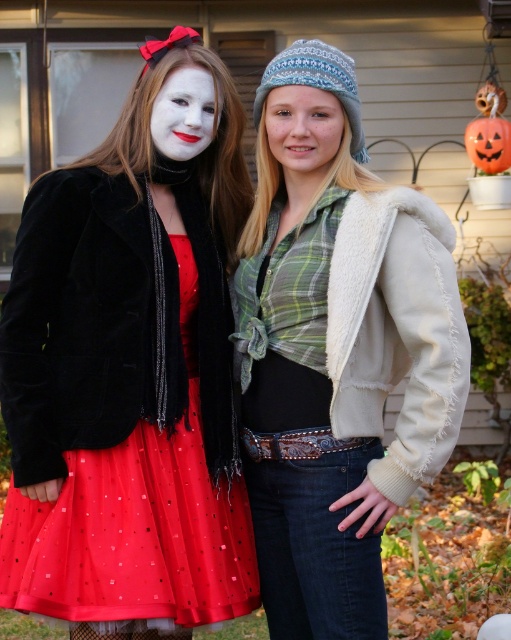
Question: Which point is closer to the camera?

Choices:
 (A) tap(309, 115)
 (B) tap(385, 364)
 (C) tap(18, 460)
 (D) tap(206, 74)

Answer: (C)

Question: From the image, what is the correct spatial relationship of white knit hat at upper center in relation to smooth knit hat at center?

Choices:
 (A) below
 (B) above

Answer: (A)

Question: Among these points, which one is nearest to the camera?

Choices:
 (A) (396, 225)
 (B) (288, 140)

Answer: (A)

Question: Which object is the closest to the white knit hat at upper center?

Choices:
 (A) smooth knit hat at center
 (B) velvet black jacket at left
 (C) matte white face at center

Answer: (A)

Question: Does smooth knit hat at center have a lesser width compared to matte white face at center?

Choices:
 (A) yes
 (B) no

Answer: (B)

Question: Is velvet black jacket at left further to camera compared to matte white face at center?

Choices:
 (A) no
 (B) yes

Answer: (A)